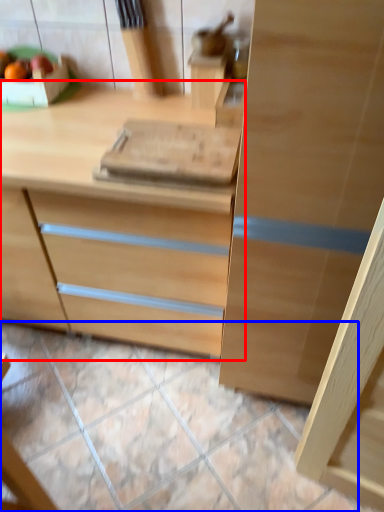
Question: Which object is closer to the camera taking this photo, chest of drawers (highlighted by a red box) or tile (highlighted by a blue box)?

Choices:
 (A) chest of drawers
 (B) tile

Answer: (A)